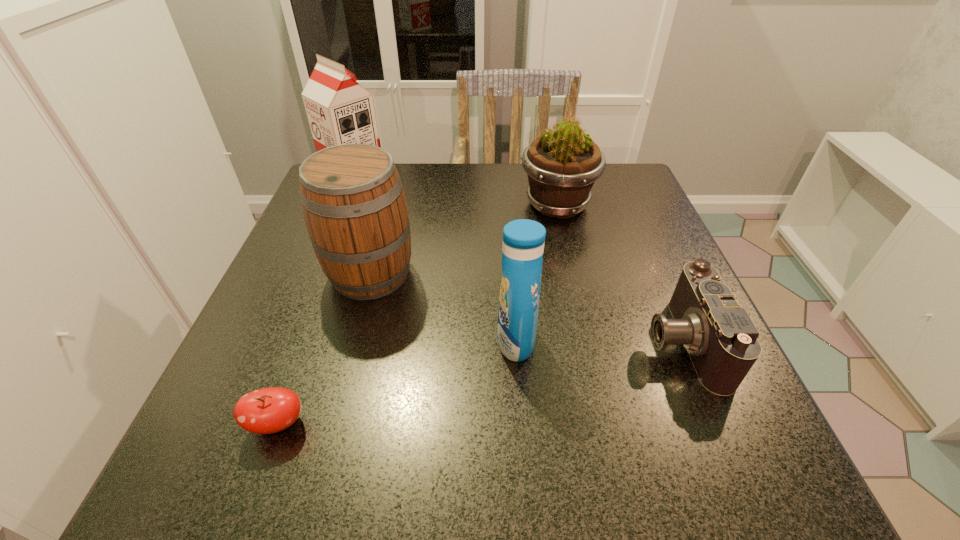
Locate an element on the screen. free space at the near edge is located at coordinates (630, 434).

The width and height of the screenshot is (960, 540). In order to click on blank space at the left edge of the desktop in this screenshot , I will do `click(322, 367)`.

You are a GUI agent. You are given a task and a screenshot of the screen. Output one action in this format:
    pyautogui.click(x=<x>, y=<y>)
    Task: Click on the vacant space at the right edge of the desktop
    
    Given the screenshot: What is the action you would take?
    [647, 251]

Identify the location of vacant space at the far right corner of the desktop. (612, 170).

Where is `vacant space at the near right corner of the desktop`? Image resolution: width=960 pixels, height=540 pixels. vacant space at the near right corner of the desktop is located at coordinates (762, 436).

Image resolution: width=960 pixels, height=540 pixels. What are the coordinates of `free space between the flowerpot and the apple` in the screenshot? It's located at (418, 314).

I want to click on blank region between the flowerpot and the fifth tallest object, so pos(619,273).

Where is `vacant space that is in between the flowerpot and the camera`? This screenshot has width=960, height=540. vacant space that is in between the flowerpot and the camera is located at coordinates (619, 273).

Find the location of a particular element. The image size is (960, 540). free space between the shortest object and the detergent is located at coordinates (396, 382).

Locate an element on the screen. Image resolution: width=960 pixels, height=540 pixels. vacant space in between the flowerpot and the apple is located at coordinates (418, 314).